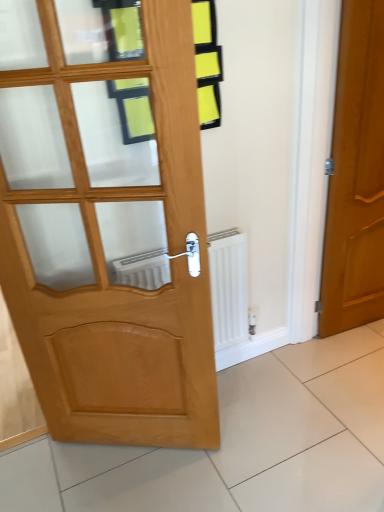
Question: From the image's perspective, is white matte radiator at center over glossy wood door at right, the 1th door from the right?

Choices:
 (A) yes
 (B) no

Answer: (B)

Question: Is white matte radiator at center positioned before glossy wood door at right, the 1th door from the right?

Choices:
 (A) no
 (B) yes

Answer: (A)

Question: Considering the relative sizes of white matte radiator at center and glossy wood door at right, the 1th door from the right, in the image provided, is white matte radiator at center thinner than glossy wood door at right, the 1th door from the right,?

Choices:
 (A) no
 (B) yes

Answer: (A)

Question: Is white matte radiator at center to the right of glossy wood door at right, which appears as the 2th door when viewed from the left, from the viewer's perspective?

Choices:
 (A) yes
 (B) no

Answer: (B)

Question: From the image's perspective, is white matte radiator at center located beneath glossy wood door at right, which appears as the 2th door when viewed from the left?

Choices:
 (A) yes
 (B) no

Answer: (A)

Question: Is point (117, 280) positioned closer to the camera than point (342, 316)?

Choices:
 (A) closer
 (B) farther

Answer: (A)

Question: Is white matte radiator at center to the left or to the right of glossy wood door at right, which appears as the 2th door when viewed from the left, in the image?

Choices:
 (A) left
 (B) right

Answer: (A)

Question: From a real-world perspective, is white matte radiator at center positioned above or below glossy wood door at right, which appears as the 2th door when viewed from the left?

Choices:
 (A) above
 (B) below

Answer: (B)

Question: Relative to glossy wood door at right, which appears as the 2th door when viewed from the left, is white matte radiator at center in front or behind?

Choices:
 (A) front
 (B) behind

Answer: (B)

Question: From a real-world perspective, relative to light brown wooden door at left, acting as the first door starting from the left, is white matte radiator at center vertically above or below?

Choices:
 (A) below
 (B) above

Answer: (A)

Question: In terms of width, does white matte radiator at center look wider or thinner when compared to light brown wooden door at left, which is counted as the 2th door, starting from the right?

Choices:
 (A) thin
 (B) wide

Answer: (B)

Question: Relative to light brown wooden door at left, which is counted as the 2th door, starting from the right, is white matte radiator at center in front or behind?

Choices:
 (A) front
 (B) behind

Answer: (B)

Question: Considering the positions of white matte radiator at center and light brown wooden door at left, acting as the first door starting from the left, in the image, is white matte radiator at center bigger or smaller than light brown wooden door at left, acting as the first door starting from the left,?

Choices:
 (A) big
 (B) small

Answer: (B)

Question: From a real-world perspective, is glossy wood door at right, which appears as the 2th door when viewed from the left, above or below white matte radiator at center?

Choices:
 (A) above
 (B) below

Answer: (A)

Question: Would you say glossy wood door at right, which appears as the 2th door when viewed from the left, is to the left or to the right of white matte radiator at center in the picture?

Choices:
 (A) right
 (B) left

Answer: (A)